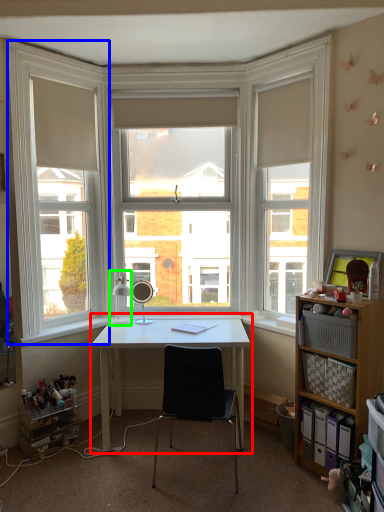
Question: Which object is positioned farthest from desk (highlighted by a red box)? Select from window frame (highlighted by a blue box) and table lamp (highlighted by a green box).

Choices:
 (A) window frame
 (B) table lamp

Answer: (A)